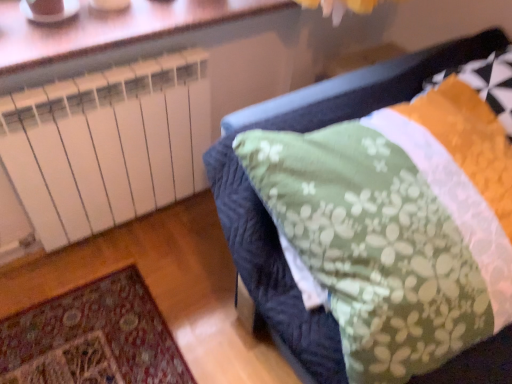
Question: Is orange textured pillow at upper right wider or thinner than white plastic radiator at upper left?

Choices:
 (A) wide
 (B) thin

Answer: (B)

Question: From a real-world perspective, is orange textured pillow at upper right positioned above or below white plastic radiator at upper left?

Choices:
 (A) below
 (B) above

Answer: (A)

Question: Based on their relative distances, which object is nearer to the white plastic radiator at upper left?

Choices:
 (A) green floral fabric at center
 (B) orange textured pillow at upper right

Answer: (A)

Question: Which object is the closest to the white plastic radiator at upper left?

Choices:
 (A) green floral fabric at center
 (B) orange textured pillow at upper right

Answer: (A)